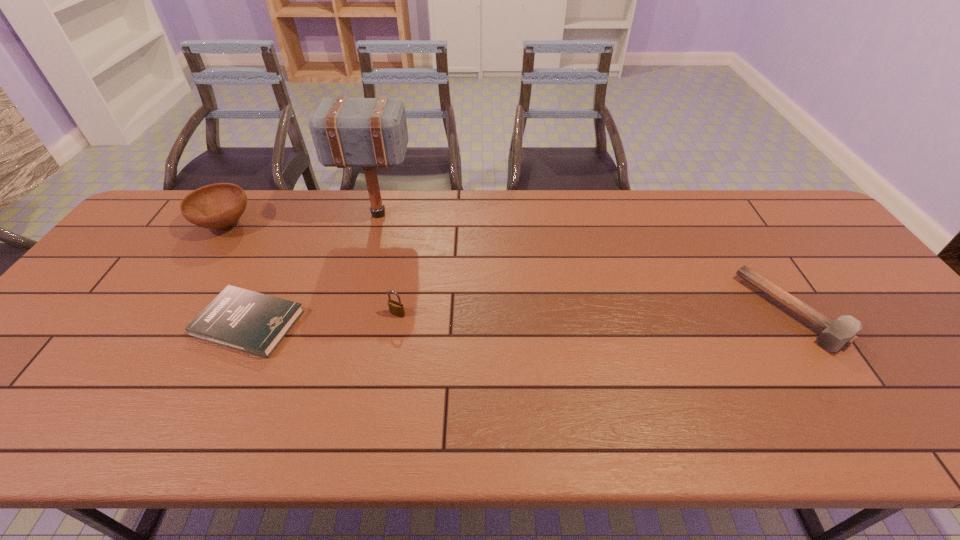
Image resolution: width=960 pixels, height=540 pixels. I want to click on empty space between the bowl and the second shortest object, so click(509, 268).

I want to click on blank region between the rightmost object and the third shortest object, so click(x=595, y=312).

Locate which object ranks fourth in proximity to the shortest object. Please provide its 2D coordinates. Your answer should be formatted as a tuple, i.e. [(x, y)], where the tuple contains the x and y coordinates of a point satisfying the conditions above.

[(835, 335)]

At what (x,y) coordinates should I click in order to perform the action: click on object that is the third closest one to the leftmost object. Please return your answer as a coordinate pair (x, y). Looking at the image, I should click on (396, 308).

At what (x,y) coordinates should I click in order to perform the action: click on vacant area in the image that satisfies the following two spatial constraints: 1. on the back side of the shorter mallet; 2. on the left side of the fourth object from right to left. Please return your answer as a coordinate pair (x, y). The width and height of the screenshot is (960, 540). Looking at the image, I should click on (254, 311).

This screenshot has width=960, height=540. I want to click on free space that satisfies the following two spatial constraints: 1. on the striking surface of the padlock; 2. on the right side of the farther mallet, so click(x=351, y=314).